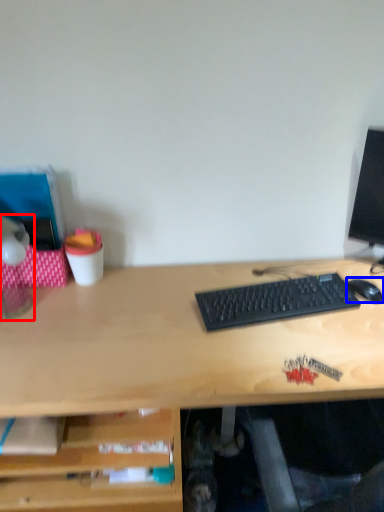
Question: Which of the following is the closest to the observer, table lamp (highlighted by a red box) or mouse (highlighted by a blue box)?

Choices:
 (A) table lamp
 (B) mouse

Answer: (A)